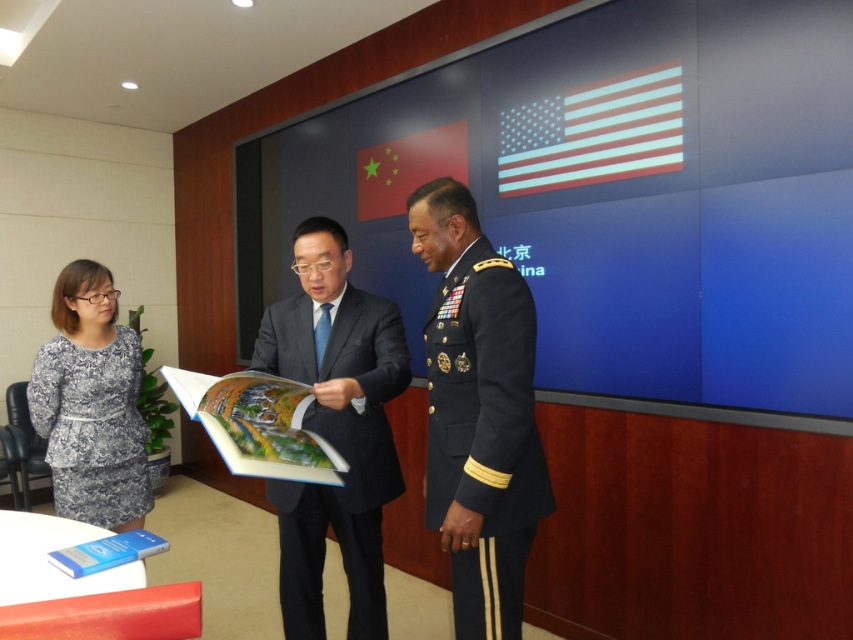
You are standing in the room and want to move from the point at coordinates point (381, 634) to the point at coordinates point (103, 401). Which direction should you move in?

You should move backward because point (381, 634) is in front of point (103, 401), so moving backward will take you towards the latter point.

You are a tailor who needs to adjust the width of the dark blue fabric military uniform at right and the dark blue military uniform at center to ensure they match. Based on the scene description, which uniform requires alterations to its width?

The dark blue fabric military uniform at right has a smaller width compared to the dark blue military uniform at center, so the dark blue fabric military uniform at right needs to be adjusted to match the width of the dark blue military uniform at center.

Based on the photo, you are standing in the room and want to move from point A to point B. Point A is the location of point (x=456, y=492) and point B is the location of point (x=312, y=529). Since you can only move forward, will you be able to reach point B without turning around?

Point (x=456, y=492) is in front of point (x=312, y=529), so if you move forward from point A, you will be able to reach point B without turning around.